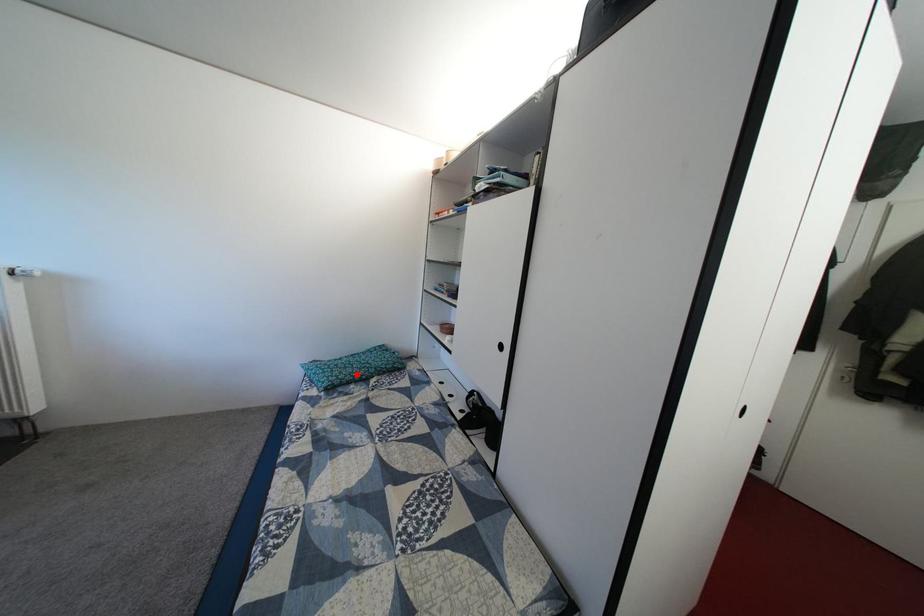
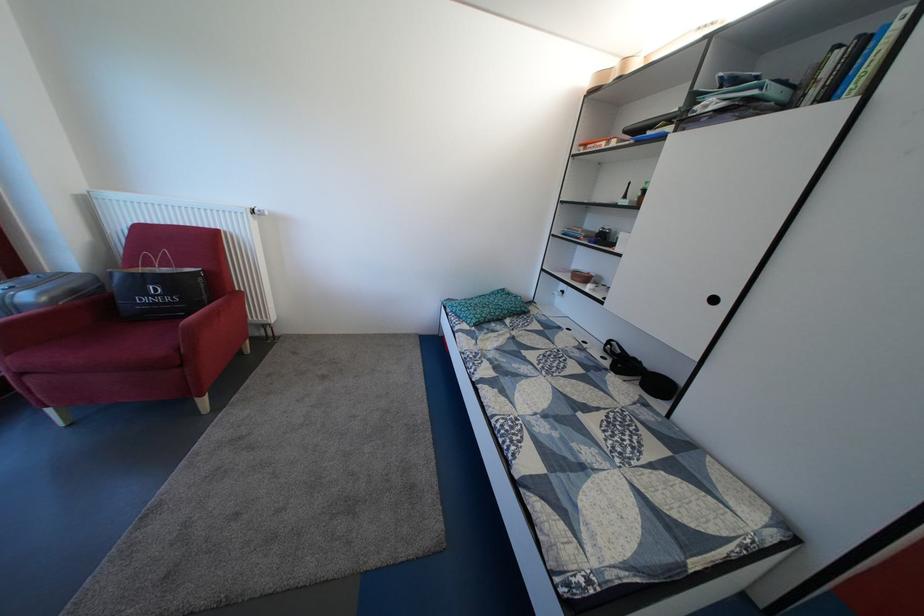
Find the pixel in the second image that matches the highlighted location in the first image.

(494, 314)